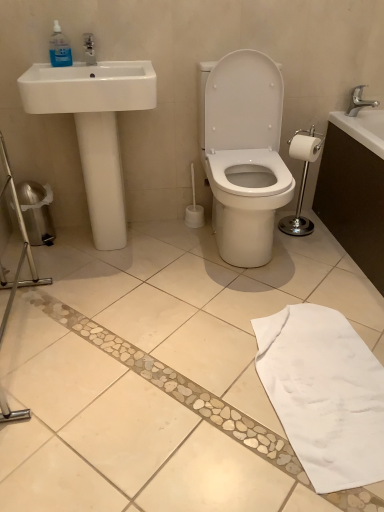
Question: From a real-world perspective, relative to transparent plastic bottle at upper left, is white matte toilet paper at right vertically above or below?

Choices:
 (A) above
 (B) below

Answer: (B)

Question: Is point (314, 154) closer or farther from the camera than point (52, 44)?

Choices:
 (A) closer
 (B) farther

Answer: (B)

Question: Which of these objects is positioned farthest from the white matte toilet paper at right?

Choices:
 (A) transparent plastic bottle at upper left
 (B) silver metallic toilet paper holder at right
 (C) white glossy toilet at center
 (D) silver metallic faucet at upper right
 (E) white cotton bath towel at lower right

Answer: (A)

Question: Estimate the real-world distances between objects in this image. Which object is farther from the white matte toilet paper at right?

Choices:
 (A) silver metallic toilet paper holder at right
 (B) silver metallic faucet at upper right
 (C) white cotton bath towel at lower right
 (D) white glossy sink at left
 (E) white glossy toilet at center

Answer: (C)